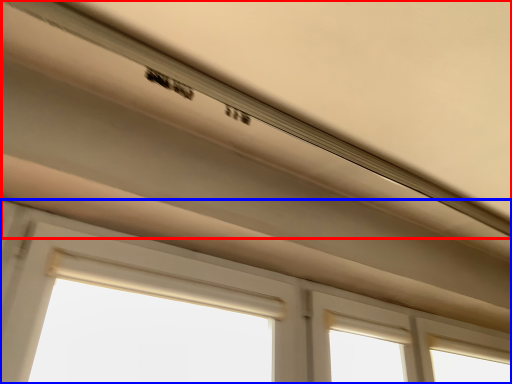
Question: Which point is closer to the camera, exhaust hood (highlighted by a red box) or window (highlighted by a blue box)?

Choices:
 (A) exhaust hood
 (B) window

Answer: (A)